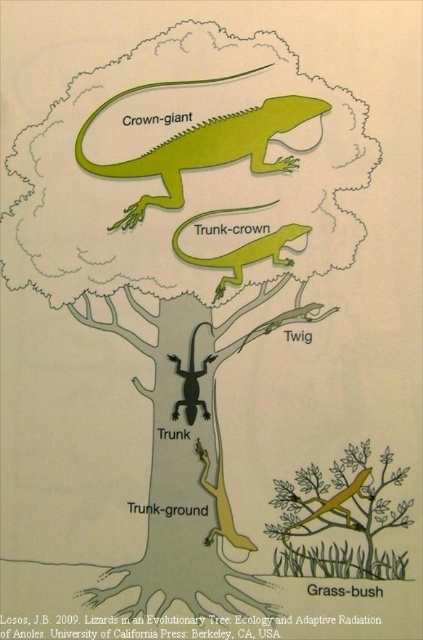
Question: Based on their relative distances, which object is nearer to the green matte lizard at trunk-crown?

Choices:
 (A) yellow matte lizard at trunk-ground
 (B) yellow matte lizard at lower right

Answer: (A)

Question: Does green matte lizard at trunk-crown appear over black matte lizard at trunk?

Choices:
 (A) no
 (B) yes

Answer: (B)

Question: Can you confirm if green matte lizard at trunk-crown is thinner than yellow matte lizard at lower right?

Choices:
 (A) yes
 (B) no

Answer: (B)

Question: Which point is closer to the camera?

Choices:
 (A) (197, 262)
 (B) (225, 512)
 (C) (125, 161)

Answer: (B)

Question: Does green matte lizard at upper center appear on the right side of green matte lizard at trunk-crown?

Choices:
 (A) no
 (B) yes

Answer: (A)

Question: Which of the following is the farthest from the observer?

Choices:
 (A) yellow matte lizard at trunk-ground
 (B) green matte lizard at upper center
 (C) black matte lizard at trunk

Answer: (B)